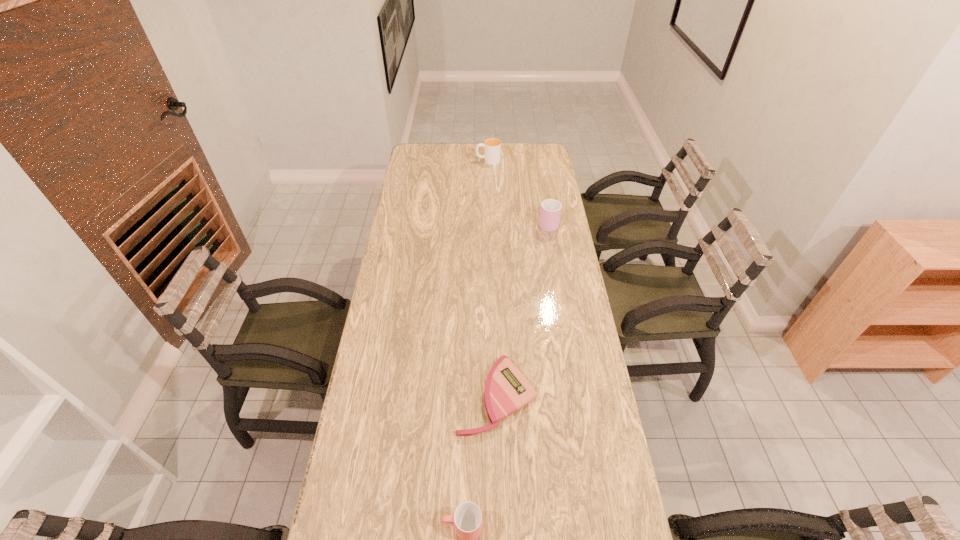
Find the location of a particular element. the second farthest cup is located at coordinates (550, 212).

Identify the location of the rightmost object. point(550,212).

You are a GUI agent. You are given a task and a screenshot of the screen. Output one action in this format:
    pyautogui.click(x=<x>, y=<y>)
    Task: Click on the farthest object
    
    Given the screenshot: What is the action you would take?
    pyautogui.click(x=492, y=146)

This screenshot has width=960, height=540. Find the location of `the shortest object`. the shortest object is located at coordinates (507, 390).

Where is `the second nearest object`? the second nearest object is located at coordinates (507, 390).

You are a GUI agent. You are given a task and a screenshot of the screen. Output one action in this format:
    pyautogui.click(x=<x>, y=<y>)
    Task: Click on the free space located with the handle on the side of the second nearest cup
    
    Given the screenshot: What is the action you would take?
    pyautogui.click(x=545, y=206)

Identify the location of free location located 0.360m with the handle on the side of the second nearest cup. This screenshot has height=540, width=960. (540, 171).

Find the location of a particular element. The image size is (960, 540). free space located with the handle on the side of the second nearest cup is located at coordinates (540, 175).

The height and width of the screenshot is (540, 960). What are the coordinates of `vacant space located with the handle on the side of the farthest cup` in the screenshot? It's located at (420, 160).

You are a GUI agent. You are given a task and a screenshot of the screen. Output one action in this format:
    pyautogui.click(x=<x>, y=<y>)
    Task: Click on the free space located with the handle on the side of the farthest cup
    Image resolution: width=960 pixels, height=540 pixels.
    Given the screenshot: What is the action you would take?
    (427, 160)